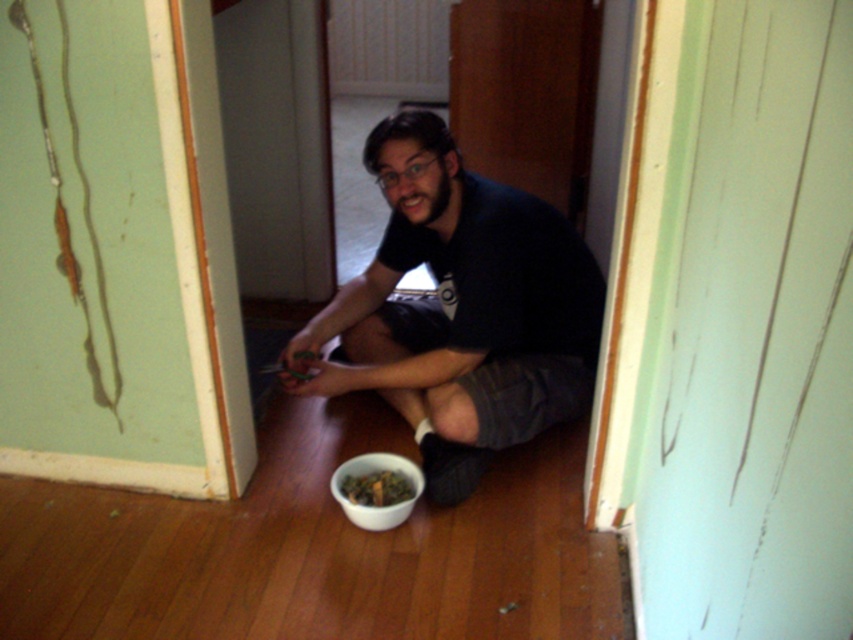
You are a delivery person who needs to place a small package on the floor next to the dark gray cotton shirt at center and the green leafy material bowl at lower center. Based on their positions, where should you place the package to be closest to both objects?

The dark gray cotton shirt at center is on the right side of the green leafy material bowl at lower center. To place the package closest to both, position it between them.

You are a delivery person who needs to place a package on the floor near the green leafy material bowl at lower center. However, there is a dark gray cotton shirt at center in the way. Can you move the shirt to access the bowl?

The dark gray cotton shirt at center is in front of the green leafy material bowl at lower center, so you need to move the shirt to access the bowl.

You are a delivery person who needs to place a small package between the dark gray cotton shirt at center and the green leafy material bowl at lower center. Can you fit the package there if it is 10 cm tall?

The dark gray cotton shirt at center is taller than the green leafy material bowl at lower center. Since the package is only 10 cm tall, it can be placed between them as long as the vertical space allows. However, the exact fit depends on the horizontal distance between the two objects, which isn